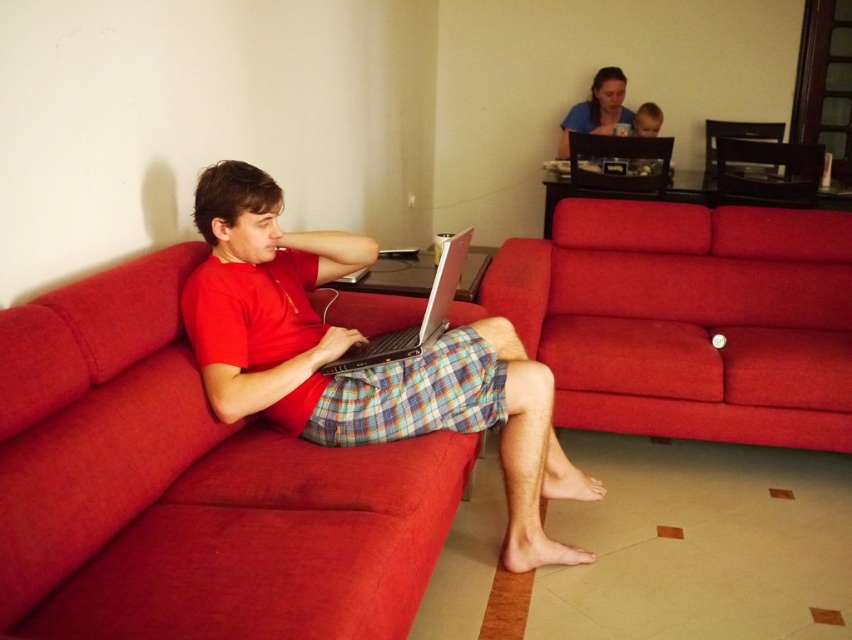
You are trying to decide between sitting on the red fabric couch at center and the velvet red couch at center. Which one is more to the left?

The red fabric couch at center is positioned on the left side of velvet red couch at center, so it is more to the left.

Looking at this image, you are standing in the living room and want to sit on the red fabric couch at center. Which direction should you walk to reach it?

The red fabric couch at center is located at point (190,486), so you should walk towards the lower right direction to reach it.

You are standing in the living room and want to place a small plant between the two points, point [262,321] and point [471,227]. Which point should the plant be closer to in order to be nearer to the viewer?

The plant should be placed closer to point [262,321] because it is closer to the viewer than point [471,227].